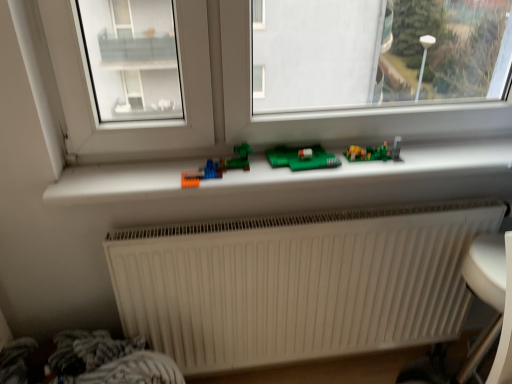
Question: From the image's perspective, is matte plastic toy at center, which is the 1th toy from right to left, over white plastic window sill at center?

Choices:
 (A) no
 (B) yes

Answer: (B)

Question: Is matte plastic toy at center, the 1th toy in the back-to-front sequence, bigger than white plastic window sill at center?

Choices:
 (A) no
 (B) yes

Answer: (A)

Question: Is matte plastic toy at center, marked as the 2th toy in a left-to-right arrangement, oriented towards white plastic window sill at center?

Choices:
 (A) yes
 (B) no

Answer: (A)

Question: From the image's perspective, does matte plastic toy at center, marked as the 2th toy in a left-to-right arrangement, appear lower than white plastic window sill at center?

Choices:
 (A) yes
 (B) no

Answer: (B)

Question: Considering the relative positions of matte plastic toy at center, the 1th toy in the back-to-front sequence, and white plastic window sill at center in the image provided, is matte plastic toy at center, the 1th toy in the back-to-front sequence, to the right of white plastic window sill at center from the viewer's perspective?

Choices:
 (A) no
 (B) yes

Answer: (B)

Question: Is white plastic window sill at center located within matte plastic toy at center, marked as the 2th toy in a left-to-right arrangement?

Choices:
 (A) yes
 (B) no

Answer: (B)

Question: Are white plastic armchair at lower right and translucent plastic toy at center, which ranks as the 2th toy in back-to-front order, making contact?

Choices:
 (A) yes
 (B) no

Answer: (B)

Question: Is white plastic armchair at lower right taller than translucent plastic toy at center, acting as the first toy starting from the left?

Choices:
 (A) yes
 (B) no

Answer: (A)

Question: Considering the relative positions of white plastic armchair at lower right and translucent plastic toy at center, which ranks as the 2th toy in back-to-front order, in the image provided, is white plastic armchair at lower right to the right of translucent plastic toy at center, which ranks as the 2th toy in back-to-front order, from the viewer's perspective?

Choices:
 (A) no
 (B) yes

Answer: (B)

Question: Does white plastic armchair at lower right come in front of translucent plastic toy at center, which ranks as the 2th toy in back-to-front order?

Choices:
 (A) no
 (B) yes

Answer: (B)

Question: From the image's perspective, does white plastic armchair at lower right appear lower than translucent plastic toy at center, acting as the first toy starting from the left?

Choices:
 (A) yes
 (B) no

Answer: (A)

Question: From a real-world perspective, is white plastic armchair at lower right physically below translucent plastic toy at center, acting as the first toy starting from the left?

Choices:
 (A) yes
 (B) no

Answer: (A)

Question: Is white ribbed radiator at lower center completely or partially outside of white plastic window sill at center?

Choices:
 (A) no
 (B) yes

Answer: (B)